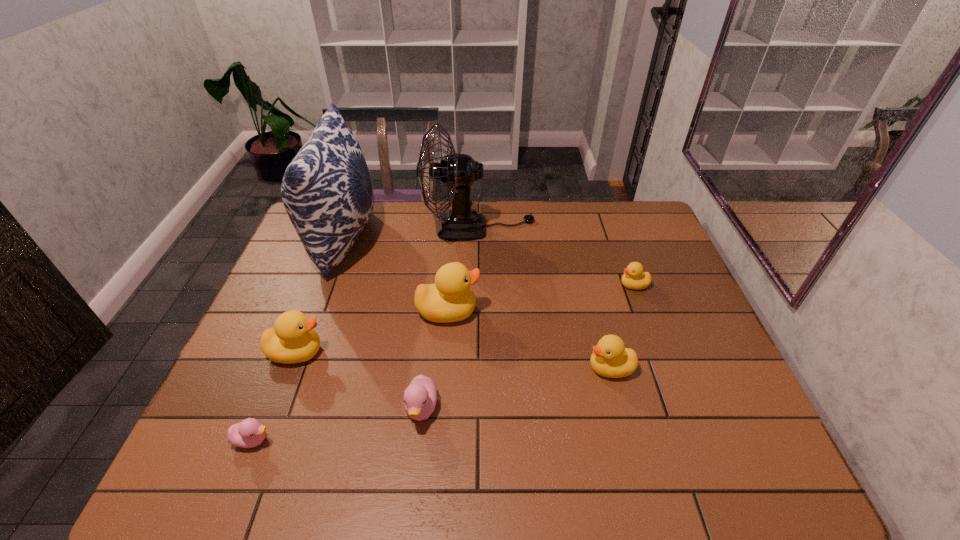
Image resolution: width=960 pixels, height=540 pixels. Identify the location of vacant space in between the blue cushion and the third yellow duckling from left to right. click(x=477, y=303).

The image size is (960, 540). Find the location of `vacant space that's between the fan and the fifth shortest object`. vacant space that's between the fan and the fifth shortest object is located at coordinates (388, 290).

Where is `vacant space that is in between the black fan and the fourth tallest object`? The width and height of the screenshot is (960, 540). vacant space that is in between the black fan and the fourth tallest object is located at coordinates (388, 290).

Image resolution: width=960 pixels, height=540 pixels. I want to click on free area in between the black fan and the rightmost duckling, so click(x=557, y=256).

I want to click on free space between the second biggest yellow duckling and the black fan, so click(388, 290).

Find the location of a particular element. This screenshot has height=540, width=960. empty space between the blue cushion and the fan is located at coordinates (411, 233).

The width and height of the screenshot is (960, 540). Find the location of `the sixth closest object to the tallest duckling`. the sixth closest object to the tallest duckling is located at coordinates (249, 433).

Locate an element on the screen. object that is the sixth closest to the fan is located at coordinates (420, 397).

Identify which duckling is the third closest to the tallest duckling. Please provide its 2D coordinates. Your answer should be formatted as a tuple, i.e. [(x, y)], where the tuple contains the x and y coordinates of a point satisfying the conditions above.

[(610, 358)]

Point out which duckling is positioned as the third nearest to the bigger pink duckling. Please provide its 2D coordinates. Your answer should be formatted as a tuple, i.e. [(x, y)], where the tuple contains the x and y coordinates of a point satisfying the conditions above.

[(249, 433)]